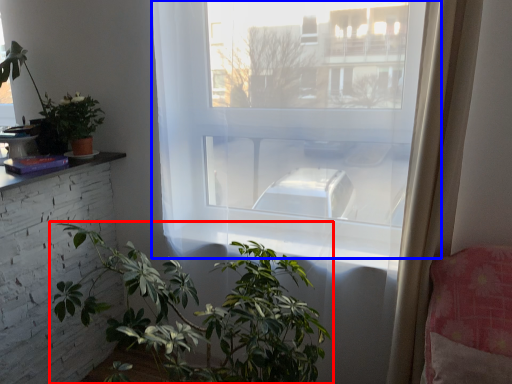
Question: Among these objects, which one is farthest to the camera, houseplant (highlighted by a red box) or window (highlighted by a blue box)?

Choices:
 (A) houseplant
 (B) window

Answer: (B)